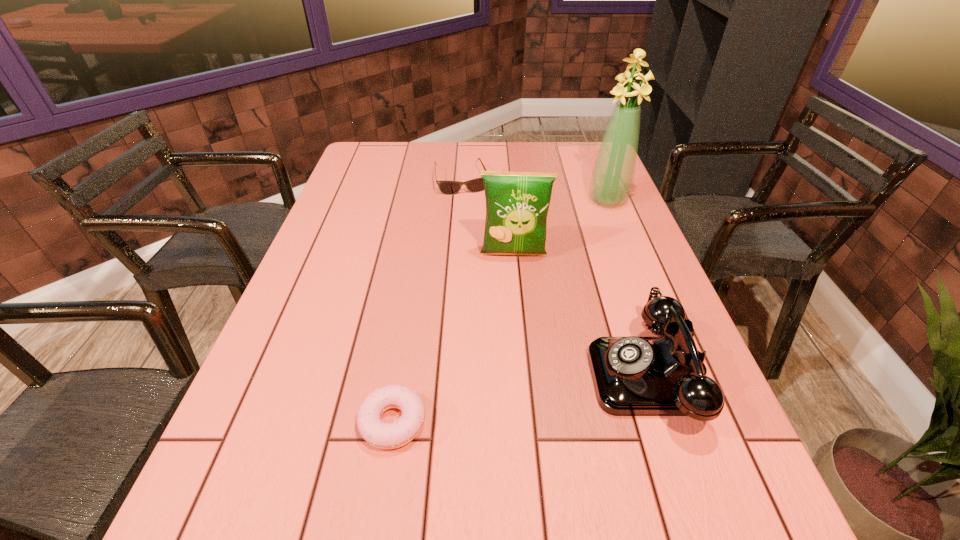
Identify the location of free space on the desktop that is between the doughnut and the telephone and is positioned on the lenses of the sunglasses. The height and width of the screenshot is (540, 960). (525, 397).

Identify the location of free space on the desktop that is between the doughnut and the telephone and is positioned on the front-facing side of the second tallest object. (516, 399).

At what (x,y) coordinates should I click in order to perform the action: click on vacant spot on the desktop that is between the doughnut and the telephone and is positioned on the front-facing side of the bouquet. Please return your answer as a coordinate pair (x, y). Looking at the image, I should click on (508, 401).